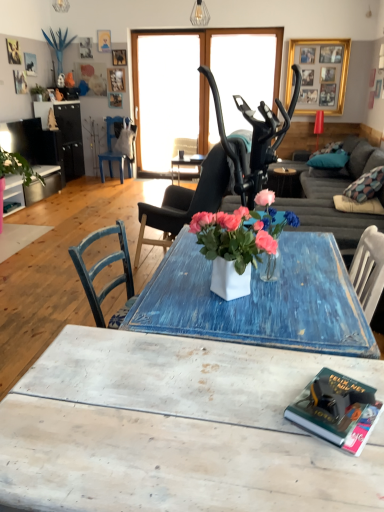
This screenshot has height=512, width=384. Find the location of `free space to the left of hardcover book at lower right`. free space to the left of hardcover book at lower right is located at coordinates (259, 414).